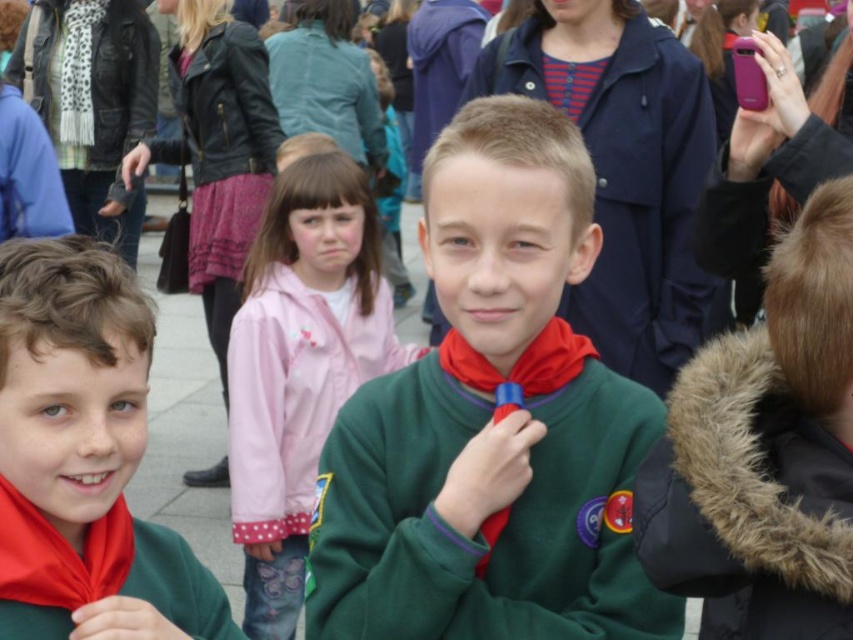
Question: Can you confirm if green fleece jacket at center is positioned below matte green sweater at center?

Choices:
 (A) yes
 (B) no

Answer: (B)

Question: Which object is the closest to the green fleece jacket at center?

Choices:
 (A) green fleece sweater at center
 (B) matte green sweater at center

Answer: (A)

Question: Can you confirm if green fleece jacket at center is wider than matte green sweater at center?

Choices:
 (A) yes
 (B) no

Answer: (A)

Question: Is green fleece sweater at center further to camera compared to matte green sweater at center?

Choices:
 (A) yes
 (B) no

Answer: (A)

Question: Which of the following is the closest to the observer?

Choices:
 (A) green fleece sweater at center
 (B) matte green sweater at center

Answer: (B)

Question: Which object is positioned closest to the green fleece jacket at center?

Choices:
 (A) green fleece sweater at center
 (B) matte green sweater at center

Answer: (A)